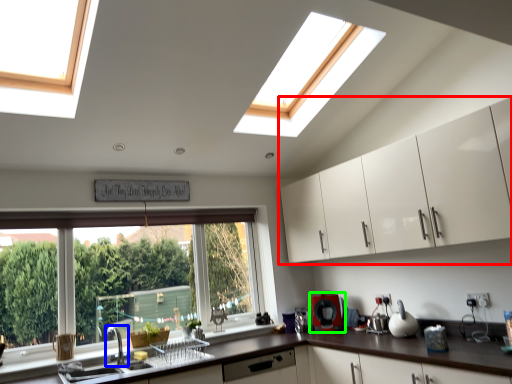
Question: Considering the real-world distances, which object is closest to cabinetry (highlighted by a red box)? tap (highlighted by a blue box) or appliance (highlighted by a green box).

Choices:
 (A) tap
 (B) appliance

Answer: (B)